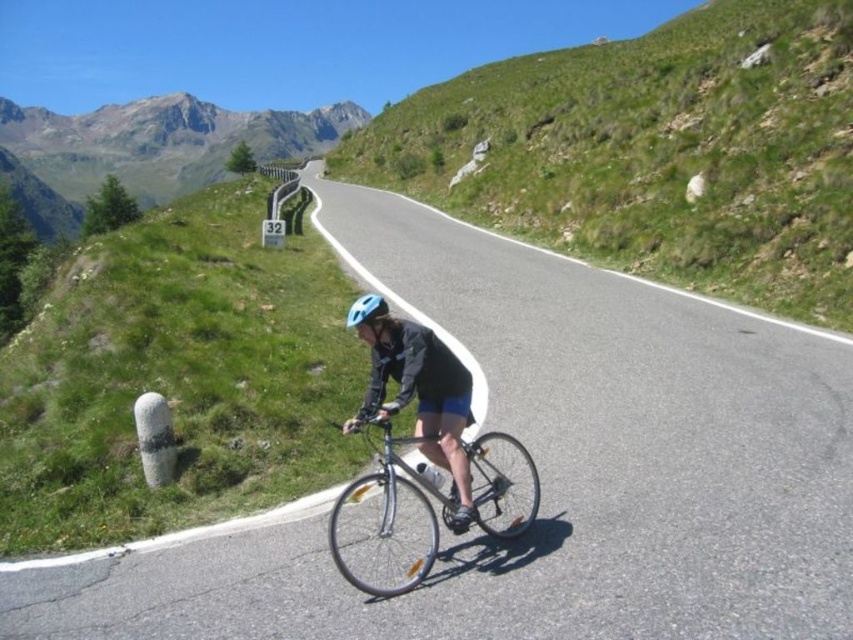
Question: Which point is farther from the camera taking this photo?

Choices:
 (A) (352, 310)
 (B) (648, 248)
 (C) (431, 410)

Answer: (B)

Question: Does rugged granite mountain at upper left appear on the left side of shiny metallic bicycle at center?

Choices:
 (A) no
 (B) yes

Answer: (B)

Question: Which point appears closest to the camera in this image?

Choices:
 (A) (445, 314)
 (B) (144, 182)
 (C) (438, 452)

Answer: (C)

Question: Is green grassy hillside at upper center to the right of matte black helmet at center from the viewer's perspective?

Choices:
 (A) no
 (B) yes

Answer: (B)

Question: Where is black asphalt road at center located in relation to matte black helmet at center in the image?

Choices:
 (A) right
 (B) left

Answer: (A)

Question: Which of the following is the farthest from the observer?

Choices:
 (A) rugged granite mountain at upper left
 (B) matte black helmet at center
 (C) green grassy hillside at upper center

Answer: (A)